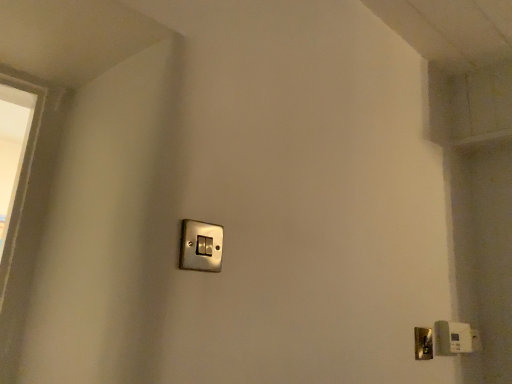
How much space does metallic silver light switch at center, placed as the second light switch when sorted from back to front, occupy horizontally?

metallic silver light switch at center, placed as the second light switch when sorted from back to front, is 1.43 inches in width.

Identify the location of metallic silver light switch at center, placed as the second light switch when sorted from back to front. This screenshot has height=384, width=512. (201, 246).

Looking at this image, considering the positions of objects metallic silver light switch at center, acting as the 1th light switch starting from the top, and polished brass door handle at lower right in the image provided, who is more to the right, metallic silver light switch at center, acting as the 1th light switch starting from the top, or polished brass door handle at lower right?

Positioned to the right is polished brass door handle at lower right.

Is metallic silver light switch at center, acting as the first light switch starting from the front, facing towards polished brass door handle at lower right?

No, metallic silver light switch at center, acting as the first light switch starting from the front, is not aimed at polished brass door handle at lower right.

Are metallic silver light switch at center, the second light switch positioned from the bottom, and polished brass door handle at lower right located far from each other?

That's not correct — metallic silver light switch at center, the second light switch positioned from the bottom, is a little close to polished brass door handle at lower right.

Is the depth of metallic silver light switch at center, the first light switch viewed from the left, less than that of polished brass door handle at lower right?

Yes.

There is a polished brass door handle at lower right. What are the coordinates of `the 1st light switch above it (from a real-world perspective)` in the screenshot? It's located at (453, 338).

Does satin silver light switch at lower right, the second light switch from the front, have a lesser height compared to polished brass door handle at lower right?

No, satin silver light switch at lower right, the second light switch from the front, is not shorter than polished brass door handle at lower right.

Does satin silver light switch at lower right, which is the first light switch from right to left, have a smaller size compared to polished brass door handle at lower right?

No, satin silver light switch at lower right, which is the first light switch from right to left, is not smaller than polished brass door handle at lower right.

Can you tell me how much satin silver light switch at lower right, which is the first light switch from right to left, and polished brass door handle at lower right differ in facing direction?

The facing directions of satin silver light switch at lower right, which is the first light switch from right to left, and polished brass door handle at lower right are 0.0225 degrees apart.

Who is shorter, polished brass door handle at lower right or satin silver light switch at lower right, the first light switch when ordered from bottom to top?

With less height is polished brass door handle at lower right.

Would you consider polished brass door handle at lower right to be distant from satin silver light switch at lower right, arranged as the second light switch when viewed from the top?

No, polished brass door handle at lower right is not far away from satin silver light switch at lower right, arranged as the second light switch when viewed from the top.

In order to click on door handle below the satin silver light switch at lower right, arranged as the 1th light switch when viewed from the back (from a real-world perspective) in this screenshot , I will do `click(423, 343)`.

From the image's perspective, is polished brass door handle at lower right located above or below satin silver light switch at lower right, the 2th light switch positioned from the left?

From the image's perspective, polished brass door handle at lower right appears above satin silver light switch at lower right, the 2th light switch positioned from the left.

Identify the location of light switch that appears on the left of polished brass door handle at lower right. Image resolution: width=512 pixels, height=384 pixels. tap(201, 246).

Based on the photo, which is farther from the camera, (419,356) or (210,231)?

The point (419,356) is farther from the camera.

Between polished brass door handle at lower right and metallic silver light switch at center, placed as the second light switch when sorted from back to front, which one has larger size?

With larger size is metallic silver light switch at center, placed as the second light switch when sorted from back to front.

You are a GUI agent. You are given a task and a screenshot of the screen. Output one action in this format:
    pyautogui.click(x=<x>, y=<y>)
    Task: Click on the light switch lying below the metallic silver light switch at center, which appears as the second light switch when viewed from the right (from the image's perspective)
    This screenshot has height=384, width=512.
    Given the screenshot: What is the action you would take?
    (453, 338)

How far apart are satin silver light switch at lower right, which is the first light switch from right to left, and metallic silver light switch at center, acting as the 1th light switch starting from the top?

satin silver light switch at lower right, which is the first light switch from right to left, and metallic silver light switch at center, acting as the 1th light switch starting from the top, are 36.24 inches apart from each other.

Does point (444, 331) appear closer or farther from the camera than point (200, 239)?

Point (444, 331) is positioned farther from the camera compared to point (200, 239).

From a real-world perspective, is satin silver light switch at lower right, arranged as the second light switch when viewed from the top, on metallic silver light switch at center, which appears as the second light switch when viewed from the right?

No, from a real-world perspective, satin silver light switch at lower right, arranged as the second light switch when viewed from the top, is not above metallic silver light switch at center, which appears as the second light switch when viewed from the right.

From their relative heights in the image, would you say metallic silver light switch at center, the first light switch viewed from the left, is taller or shorter than satin silver light switch at lower right, the second light switch from the front?

Considering their sizes, metallic silver light switch at center, the first light switch viewed from the left, has less height than satin silver light switch at lower right, the second light switch from the front.

Is the depth of metallic silver light switch at center, the first light switch viewed from the left, greater than that of satin silver light switch at lower right, arranged as the second light switch when viewed from the top?

No, it is not.

In terms of width, does metallic silver light switch at center, which appears as the second light switch when viewed from the right, look wider or thinner when compared to satin silver light switch at lower right, the 2th light switch positioned from the left?

Considering their sizes, metallic silver light switch at center, which appears as the second light switch when viewed from the right, looks slimmer than satin silver light switch at lower right, the 2th light switch positioned from the left.

Consider the image. Considering the sizes of objects metallic silver light switch at center, which appears as the second light switch when viewed from the right, and satin silver light switch at lower right, the 2th light switch positioned from the left, in the image provided, who is bigger, metallic silver light switch at center, which appears as the second light switch when viewed from the right, or satin silver light switch at lower right, the 2th light switch positioned from the left,?

satin silver light switch at lower right, the 2th light switch positioned from the left, is bigger.

This screenshot has width=512, height=384. Identify the location of door handle to the right of metallic silver light switch at center, which appears as the second light switch when viewed from the right. (423, 343).

This screenshot has width=512, height=384. I want to click on door handle on the left of satin silver light switch at lower right, arranged as the 1th light switch when viewed from the back, so click(x=423, y=343).

Which object lies further to the anchor point polished brass door handle at lower right, satin silver light switch at lower right, the 2th light switch positioned from the left, or metallic silver light switch at center, the second light switch positioned from the bottom?

metallic silver light switch at center, the second light switch positioned from the bottom.

Which object lies nearer to the anchor point polished brass door handle at lower right, metallic silver light switch at center, placed as the second light switch when sorted from back to front, or satin silver light switch at lower right, arranged as the second light switch when viewed from the top?

The object closer to polished brass door handle at lower right is satin silver light switch at lower right, arranged as the second light switch when viewed from the top.

Which object lies further to the anchor point metallic silver light switch at center, placed as the second light switch when sorted from back to front, satin silver light switch at lower right, the second light switch from the front, or polished brass door handle at lower right?

satin silver light switch at lower right, the second light switch from the front.

From the image, which object appears to be nearer to satin silver light switch at lower right, arranged as the 1th light switch when viewed from the back, polished brass door handle at lower right or metallic silver light switch at center, acting as the 1th light switch starting from the top?

polished brass door handle at lower right.

Considering their positions, is polished brass door handle at lower right positioned closer to metallic silver light switch at center, the second light switch positioned from the bottom, than satin silver light switch at lower right, the 2th light switch positioned from the left?

polished brass door handle at lower right is closer to metallic silver light switch at center, the second light switch positioned from the bottom.

Which object lies nearer to the anchor point satin silver light switch at lower right, the first light switch when ordered from bottom to top, metallic silver light switch at center, placed as the second light switch when sorted from back to front, or polished brass door handle at lower right?

Among the two, polished brass door handle at lower right is located nearer to satin silver light switch at lower right, the first light switch when ordered from bottom to top.

You are a GUI agent. You are given a task and a screenshot of the screen. Output one action in this format:
    pyautogui.click(x=<x>, y=<y>)
    Task: Click on the door handle located between metallic silver light switch at center, acting as the first light switch starting from the front, and satin silver light switch at lower right, arranged as the 1th light switch when viewed from the back, in the left-right direction
    
    Given the screenshot: What is the action you would take?
    pyautogui.click(x=423, y=343)